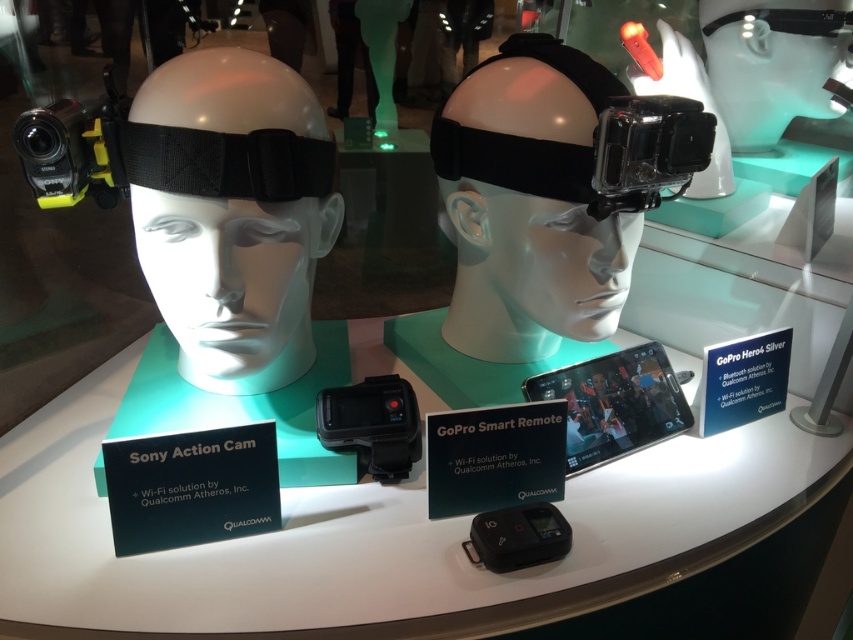
You are a customer in the store looking at the display. You want to pick up the matte black headband at center to examine it closely. Can you reach it without moving the white glossy table at center?

The white glossy table at center is below the matte black headband at center, so the headband is positioned above the table. Since the table is beneath it, you should be able to reach the matte black headband at center without needing to move the white glossy table at center.

You are a customer looking to compare the two cameras displayed on the white glossy table at center and the black matte gopro at center. Which camera is located to the right side of the table?

The black matte gopro at center is located to the right side of the white glossy table at center because the table is positioned on the left side of the GoPro.

You are a customer at an electronics store looking to compare the two action cameras displayed on the white glossy table at center and the black matte gopro at center. Can you determine which camera is placed higher?

The black matte gopro at center is placed higher because the white glossy table at center is positioned under it.